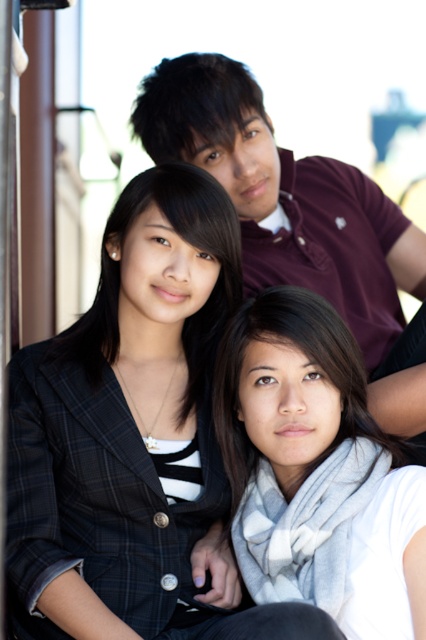
You are a photographer trying to adjust the lighting to ensure both the white soft scarf at center and the matte black hair at upper center are well lit. Which object is closer to the camera?

The white soft scarf at center is positioned under the matte black hair at upper center, meaning the matte black hair at upper center is closer to the camera.

You are a photographer trying to capture a closeup of the plaid blazer at center and the matte black hair at upper center. Which object is wider?

The plaid blazer at center is wider than the matte black hair at upper center since its width surpasses the latter.